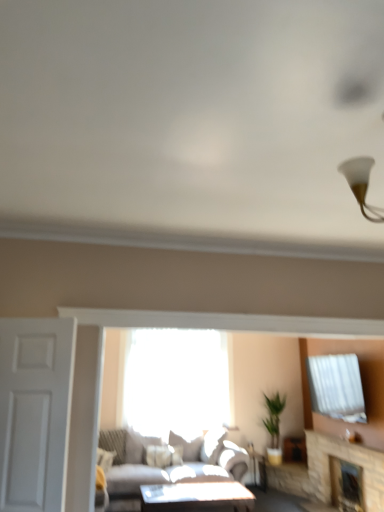
The height and width of the screenshot is (512, 384). Describe the element at coordinates (35, 412) in the screenshot. I see `white matte door at left` at that location.

Find the location of a particular element. white matte door at left is located at coordinates (35, 412).

Where is `matte white table at center`? matte white table at center is located at coordinates (196, 497).

The image size is (384, 512). What do you see at coordinates (346, 485) in the screenshot?
I see `stone fireplace at lower right, the first fireplace from the back` at bounding box center [346, 485].

What are the coordinates of `light gray fabric couch at center` in the screenshot? It's located at (147, 468).

Is stone fireplace at lower right, marked as the second fireplace in a front-to-back arrangement, turned away from light gray fabric couch at center?

stone fireplace at lower right, marked as the second fireplace in a front-to-back arrangement, does not have its back to light gray fabric couch at center.

From the picture: Is stone fireplace at lower right, marked as the second fireplace in a front-to-back arrangement, outside of light gray fabric couch at center?

That's correct, stone fireplace at lower right, marked as the second fireplace in a front-to-back arrangement, is outside of light gray fabric couch at center.

Does stone fireplace at lower right, the first fireplace from the back, have a lesser width compared to light gray fabric couch at center?

Indeed, stone fireplace at lower right, the first fireplace from the back, has a lesser width compared to light gray fabric couch at center.

Which is less distant, [347,484] or [182,464]?

Point [347,484].

Looking at this image, from a real-world perspective, does white matte door at left stand above stone fireplace at lower right, the first fireplace positioned from the front?

Indeed, from a real-world perspective, white matte door at left stands above stone fireplace at lower right, the first fireplace positioned from the front.

Locate an element on the screen. The image size is (384, 512). the 1st fireplace behind the white matte door at left is located at coordinates (348, 461).

Between white matte door at left and stone fireplace at lower right, the second fireplace in the back-to-front sequence, which one has smaller width?

white matte door at left is thinner.

Can you confirm if stone fireplace at lower right, the second fireplace in the back-to-front sequence, is thinner than transparent glass window at center?

No, stone fireplace at lower right, the second fireplace in the back-to-front sequence, is not thinner than transparent glass window at center.

How distant is stone fireplace at lower right, the second fireplace in the back-to-front sequence, from transparent glass window at center?

stone fireplace at lower right, the second fireplace in the back-to-front sequence, is 6.84 feet from transparent glass window at center.

From the image's perspective, is stone fireplace at lower right, the second fireplace in the back-to-front sequence, beneath transparent glass window at center?

Correct, stone fireplace at lower right, the second fireplace in the back-to-front sequence, appears lower than transparent glass window at center in the image.

Would you say stone fireplace at lower right, the first fireplace positioned from the front, is to the left or to the right of transparent glass window at center in the picture?

Clearly, stone fireplace at lower right, the first fireplace positioned from the front, is on the right of transparent glass window at center in the image.

Consider the image. Considering the positions of objects matte white table at center and stone fireplace at lower right, the first fireplace positioned from the front, in the image provided, who is in front, matte white table at center or stone fireplace at lower right, the first fireplace positioned from the front,?

Positioned in front is stone fireplace at lower right, the first fireplace positioned from the front.

Is matte white table at center looking in the opposite direction of stone fireplace at lower right, the second fireplace in the back-to-front sequence?

That's not correct — matte white table at center is not looking away from stone fireplace at lower right, the second fireplace in the back-to-front sequence.

How many degrees apart are the facing directions of matte white table at center and stone fireplace at lower right, the first fireplace positioned from the front?

88.2 degrees.

Who is bigger, matte white table at center or stone fireplace at lower right, the second fireplace in the back-to-front sequence?

stone fireplace at lower right, the second fireplace in the back-to-front sequence.

From their relative heights in the image, would you say stone fireplace at lower right, marked as the second fireplace in a front-to-back arrangement, is taller or shorter than stone fireplace at lower right, the first fireplace positioned from the front?

Considering their sizes, stone fireplace at lower right, marked as the second fireplace in a front-to-back arrangement, has less height than stone fireplace at lower right, the first fireplace positioned from the front.

From a real-world perspective, is stone fireplace at lower right, marked as the second fireplace in a front-to-back arrangement, physically located above or below stone fireplace at lower right, the first fireplace positioned from the front?

In terms of real-world spatial position, stone fireplace at lower right, marked as the second fireplace in a front-to-back arrangement, is below stone fireplace at lower right, the first fireplace positioned from the front.

Is point (361, 499) in front of point (310, 476)?

Yes, it is in front of point (310, 476).

Is stone fireplace at lower right, marked as the second fireplace in a front-to-back arrangement, oriented towards stone fireplace at lower right, the second fireplace in the back-to-front sequence?

Yes, stone fireplace at lower right, marked as the second fireplace in a front-to-back arrangement, is facing stone fireplace at lower right, the second fireplace in the back-to-front sequence.

Is matte white side table at lower center placed right next to white matte door at left?

No, matte white side table at lower center is not next to white matte door at left.

Does matte white side table at lower center turn towards white matte door at left?

No, matte white side table at lower center is not oriented towards white matte door at left.

Looking at this image, in terms of width, does matte white side table at lower center look wider or thinner when compared to white matte door at left?

Considering their sizes, matte white side table at lower center looks broader than white matte door at left.

Who is bigger, matte white side table at lower center or white matte door at left?

white matte door at left.

From a real-world perspective, is stone fireplace at lower right, marked as the second fireplace in a front-to-back arrangement, located beneath transparent glass window at center?

Indeed, from a real-world perspective, stone fireplace at lower right, marked as the second fireplace in a front-to-back arrangement, is positioned beneath transparent glass window at center.

Is stone fireplace at lower right, marked as the second fireplace in a front-to-back arrangement, inside the boundaries of transparent glass window at center, or outside?

stone fireplace at lower right, marked as the second fireplace in a front-to-back arrangement, is outside transparent glass window at center.

In terms of width, does stone fireplace at lower right, marked as the second fireplace in a front-to-back arrangement, look wider or thinner when compared to transparent glass window at center?

Clearly, stone fireplace at lower right, marked as the second fireplace in a front-to-back arrangement, has more width compared to transparent glass window at center.

From the image's perspective, is stone fireplace at lower right, marked as the second fireplace in a front-to-back arrangement, located above or below transparent glass window at center?

stone fireplace at lower right, marked as the second fireplace in a front-to-back arrangement, is below transparent glass window at center.

Where is `the 2nd fireplace behind the light gray fabric couch at center`? the 2nd fireplace behind the light gray fabric couch at center is located at coordinates (346, 485).

The width and height of the screenshot is (384, 512). What are the coordinates of `fireplace that is the 1st one when counting downward from the white matte door at left (from the image's perspective)` in the screenshot? It's located at (348, 461).

Considering their positions, is white matte door at left positioned further to stone fireplace at lower right, the first fireplace from the back, than matte white table at center?

white matte door at left lies further to stone fireplace at lower right, the first fireplace from the back, than the other object.

In the scene shown: Based on their spatial positions, is matte white side table at lower center or white matte door at left closer to matte white table at center?

matte white side table at lower center.

Looking at the image, which one is located further to matte white side table at lower center, transparent glass window at center or matte white table at center?

matte white table at center lies further to matte white side table at lower center than the other object.

Considering their positions, is light gray fabric couch at center positioned further to white matte door at left than stone fireplace at lower right, the second fireplace in the back-to-front sequence?

The object further to white matte door at left is stone fireplace at lower right, the second fireplace in the back-to-front sequence.

Which object lies further to the anchor point stone fireplace at lower right, the first fireplace from the back, stone fireplace at lower right, the second fireplace in the back-to-front sequence, or transparent glass window at center?

transparent glass window at center is positioned further to the anchor stone fireplace at lower right, the first fireplace from the back.

Looking at the image, which one is located further to stone fireplace at lower right, marked as the second fireplace in a front-to-back arrangement, matte white side table at lower center or white matte door at left?

white matte door at left.

Considering their positions, is matte white table at center positioned closer to stone fireplace at lower right, the second fireplace in the back-to-front sequence, than transparent glass window at center?

Based on the image, matte white table at center appears to be nearer to stone fireplace at lower right, the second fireplace in the back-to-front sequence.

From the image, which object appears to be nearer to matte white table at center, transparent glass window at center or matte white side table at lower center?

The object closer to matte white table at center is matte white side table at lower center.

This screenshot has height=512, width=384. What are the coordinates of `fireplace located between white matte door at left and stone fireplace at lower right, marked as the second fireplace in a front-to-back arrangement, in the left-right direction` in the screenshot? It's located at (348, 461).

The width and height of the screenshot is (384, 512). Identify the location of side table between stone fireplace at lower right, the first fireplace positioned from the front, and transparent glass window at center in the front-back direction. (258, 466).

Locate an element on the screen. Image resolution: width=384 pixels, height=512 pixels. fireplace between matte white table at center and matte white side table at lower center in the front-back direction is located at coordinates (346, 485).

Image resolution: width=384 pixels, height=512 pixels. What are the coordinates of `studio couch located between white matte door at left and transparent glass window at center in the depth direction` in the screenshot? It's located at (147, 468).